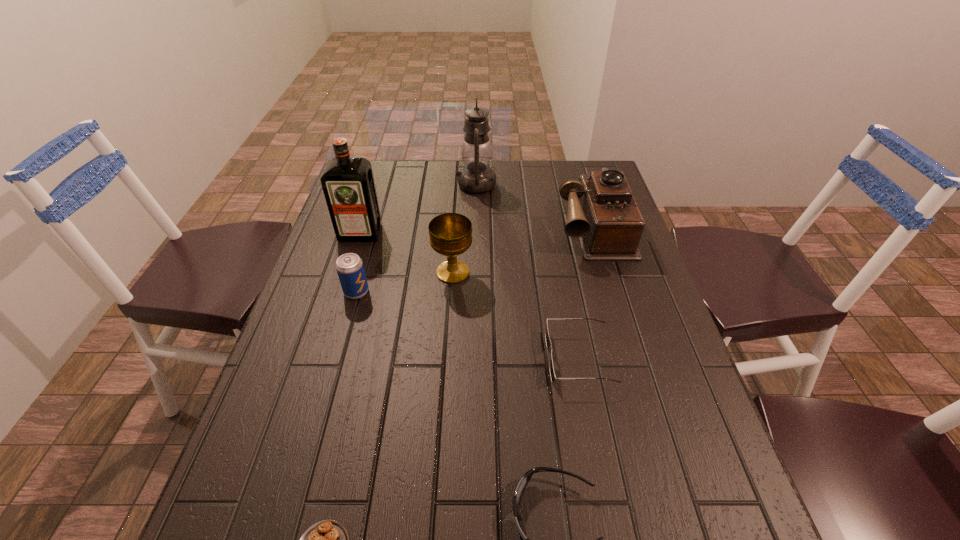
Locate an element on the screen. This screenshot has height=540, width=960. oil lamp is located at coordinates (476, 177).

Locate an element on the screen. The height and width of the screenshot is (540, 960). liquor is located at coordinates (348, 184).

Identify the location of phonograph_record. Image resolution: width=960 pixels, height=540 pixels. (x=602, y=212).

You are a GUI agent. You are given a task and a screenshot of the screen. Output one action in this format:
    pyautogui.click(x=<x>, y=<y>)
    Task: Click on the chalice
    
    Given the screenshot: What is the action you would take?
    pyautogui.click(x=450, y=234)

In order to click on the fifth tallest object in this screenshot , I will do `click(349, 266)`.

The height and width of the screenshot is (540, 960). Find the location of `the farther sunglasses`. the farther sunglasses is located at coordinates (548, 342).

Find the location of `free space located on the right of the oil lamp`. free space located on the right of the oil lamp is located at coordinates (532, 185).

At what (x,y) coordinates should I click in order to perform the action: click on vacant space situated 0.090m on the front label of the liquor. Please return your answer as a coordinate pair (x, y). The height and width of the screenshot is (540, 960). Looking at the image, I should click on (350, 264).

In order to click on free space located on the horn of the phonograph_record in this screenshot , I will do `click(639, 383)`.

Identify the location of vacant space located 0.330m on the right of the chalice. (595, 273).